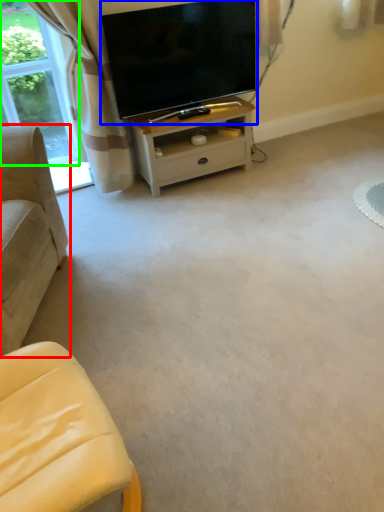
Question: Which object is the farthest from studio couch (highlighted by a red box)? Choose among these: television (highlighted by a blue box) or bay window (highlighted by a green box).

Choices:
 (A) television
 (B) bay window

Answer: (B)